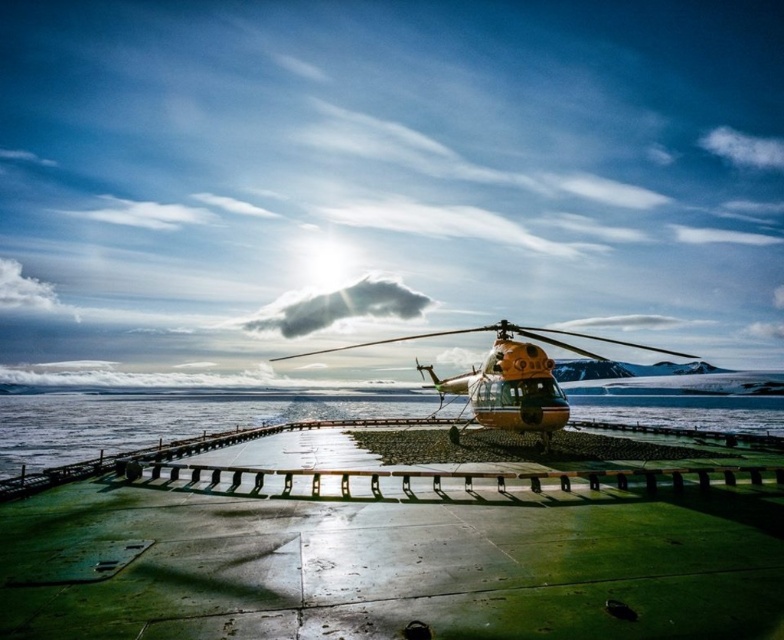
Can you confirm if green concrete dock at center is wider than translucent ice water at center?

In fact, green concrete dock at center might be narrower than translucent ice water at center.

Is green concrete dock at center smaller than translucent ice water at center?

Yes.

Is point (596, 589) closer to viewer compared to point (20, 432)?

That is True.

This screenshot has height=640, width=784. I want to click on green concrete dock at center, so click(387, 554).

Which of these two, green concrete dock at center or orange matte helicopter at center, stands shorter?

With less height is green concrete dock at center.

Based on the photo, is green concrete dock at center closer to the viewer compared to orange matte helicopter at center?

Yes, green concrete dock at center is closer to the viewer.

The width and height of the screenshot is (784, 640). In order to click on green concrete dock at center in this screenshot , I will do `click(387, 554)`.

Is translucent ice water at center below orange matte helicopter at center?

Yes, translucent ice water at center is below orange matte helicopter at center.

Does translucent ice water at center lie in front of orange matte helicopter at center?

No, it is behind orange matte helicopter at center.

Where is `translucent ice water at center`? translucent ice water at center is located at coordinates (158, 420).

Identify the location of translucent ice water at center. click(158, 420).